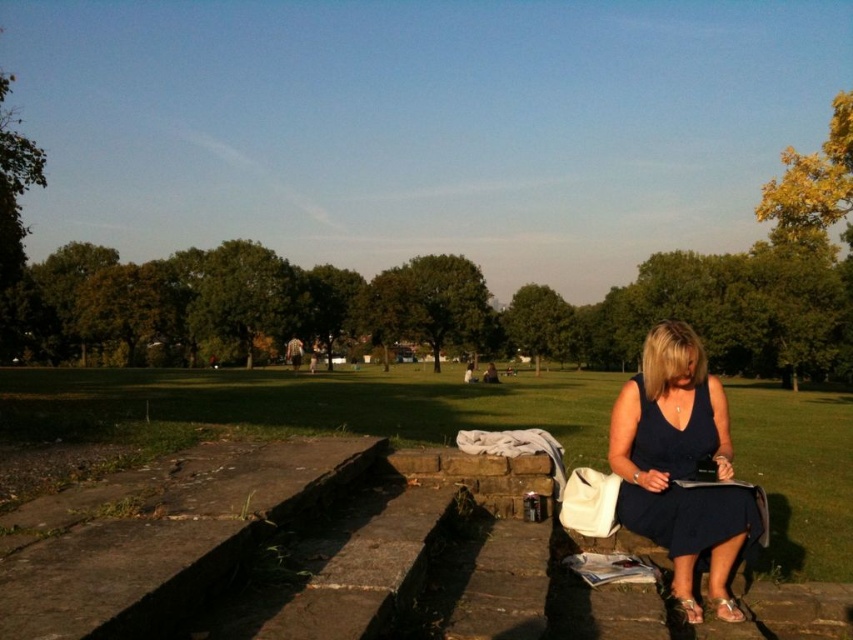
Can you confirm if navy blue dress at lower right is shorter than suede-like beige sandal at lower right?

No.

Which is more to the right, navy blue dress at lower right or suede-like beige sandal at lower right?

navy blue dress at lower right is more to the right.

Is point (683, 340) closer to camera compared to point (695, 612)?

No, (683, 340) is behind (695, 612).

This screenshot has height=640, width=853. Identify the location of navy blue dress at lower right. (677, 458).

Who is taller, metallic gold sandal at lower right or suede-like beige sandal at lower right?

With more height is suede-like beige sandal at lower right.

Measure the distance between metallic gold sandal at lower right and camera.

metallic gold sandal at lower right is 3.67 meters from camera.

Locate an element on the screen. This screenshot has width=853, height=640. metallic gold sandal at lower right is located at coordinates (724, 608).

Where is `metallic gold sandal at lower right`? The image size is (853, 640). metallic gold sandal at lower right is located at coordinates (724, 608).

Looking at this image, how far apart are navy blue dress at lower right and metallic gold sandal at lower right?

The distance of navy blue dress at lower right from metallic gold sandal at lower right is 12.46 inches.

Can you confirm if navy blue dress at lower right is positioned above metallic gold sandal at lower right?

Yes, navy blue dress at lower right is above metallic gold sandal at lower right.

Between point (612, 449) and point (722, 609), which one is positioned behind?

The point (612, 449) is behind.

I want to click on navy blue dress at lower right, so click(677, 458).